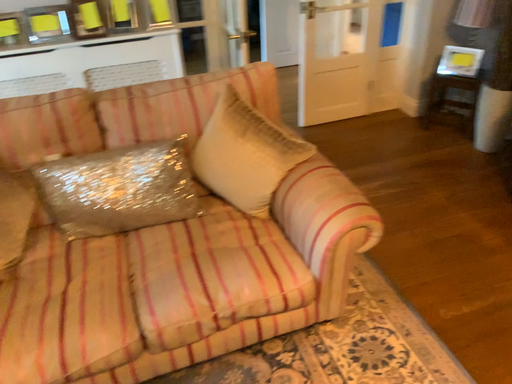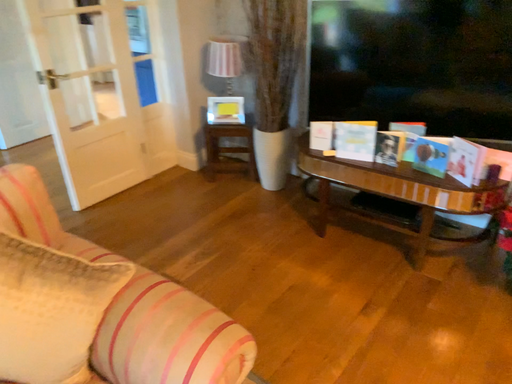
Question: How did the camera likely rotate when shooting the video?

Choices:
 (A) rotated left
 (B) rotated right

Answer: (B)